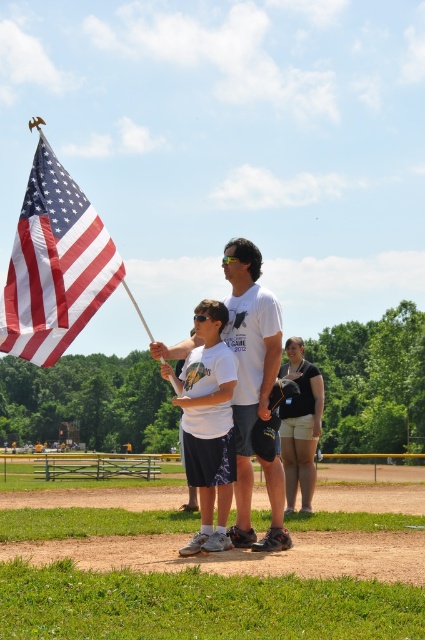
You are standing at the center of the baseball field and want to hand the flag to the boy holding the american flag at left. In which direction should you walk to reach him?

The american flag at left is located at point 0.414 on the x and 0.129 on the y axis. Since the flag is on the left side of the image, you should walk to your left to reach the boy holding it.